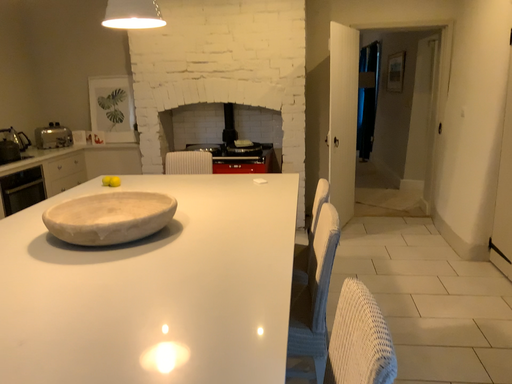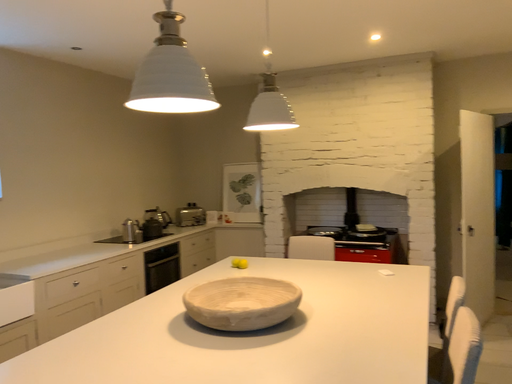
Question: Which way did the camera rotate in the video?

Choices:
 (A) rotated right
 (B) rotated left

Answer: (B)